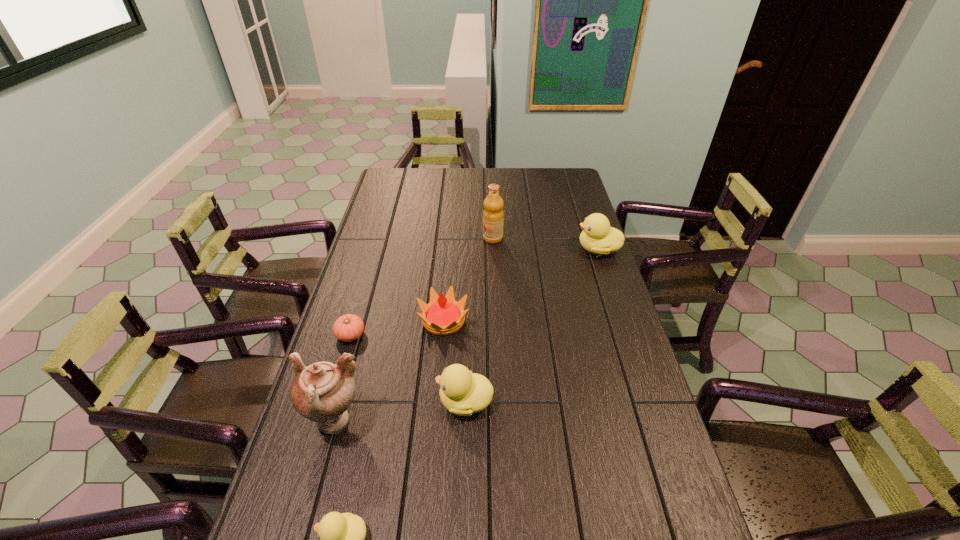
You are a GUI agent. You are given a task and a screenshot of the screen. Output one action in this format:
    pyautogui.click(x=<x>, y=<y>)
    Task: Click on the tomato situated at the left edge
    
    Given the screenshot: What is the action you would take?
    pyautogui.click(x=349, y=327)

Locate an element on the screen. The height and width of the screenshot is (540, 960). urn that is at the left edge is located at coordinates (322, 392).

Identify the location of object present at the right edge. The height and width of the screenshot is (540, 960). (x=597, y=237).

This screenshot has height=540, width=960. I want to click on free space at the far edge of the desktop, so click(424, 189).

Identify the location of vacant space at the near edge. The width and height of the screenshot is (960, 540). (603, 518).

Image resolution: width=960 pixels, height=540 pixels. Identify the location of free space at the left edge of the desktop. (353, 462).

Locate an element on the screen. The height and width of the screenshot is (540, 960). vacant region at the right edge is located at coordinates (616, 407).

Identify the location of vacant area at the far left corner. (404, 190).

This screenshot has width=960, height=540. In order to click on free space at the near left corner of the desktop in this screenshot , I will do `click(265, 538)`.

The image size is (960, 540). I want to click on free space at the far right corner of the desktop, so click(x=558, y=186).